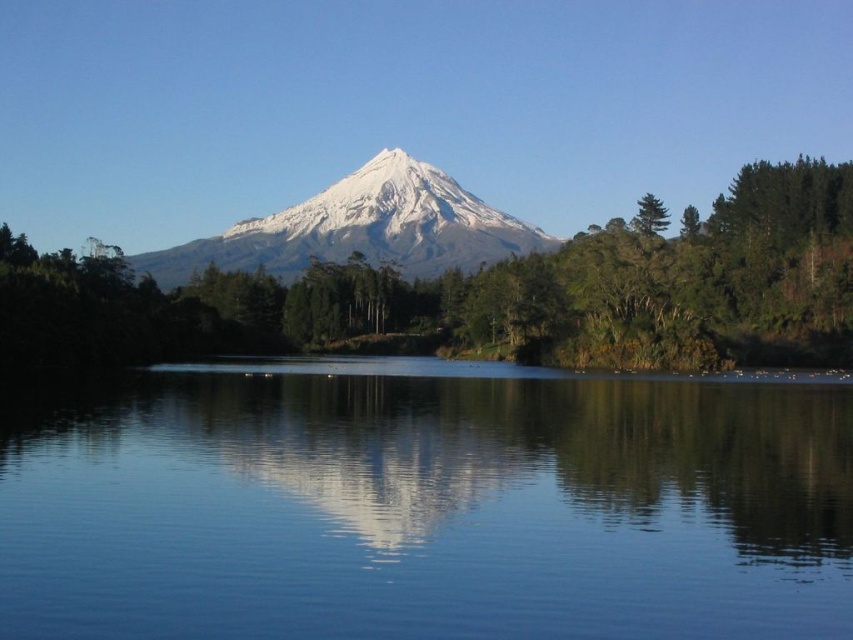
Question: Observing the image, what is the correct spatial positioning of green leafy trees at center in reference to green matte tree at upper right?

Choices:
 (A) above
 (B) below

Answer: (B)

Question: Which object is positioned closest to the green leafy trees at center?

Choices:
 (A) white snow-covered mountain at center
 (B) green matte tree at upper right

Answer: (A)

Question: Is white snow-covered mountain at center positioned behind green matte tree at upper right?

Choices:
 (A) yes
 (B) no

Answer: (A)

Question: Can you confirm if smooth blue water at center is thinner than white snow-covered mountain at center?

Choices:
 (A) no
 (B) yes

Answer: (B)

Question: Among these objects, which one is farthest from the camera?

Choices:
 (A) green leafy trees at center
 (B) green matte tree at upper right
 (C) smooth blue water at center

Answer: (B)

Question: Which point is closer to the camera?

Choices:
 (A) green matte tree at upper right
 (B) green leafy trees at center

Answer: (B)